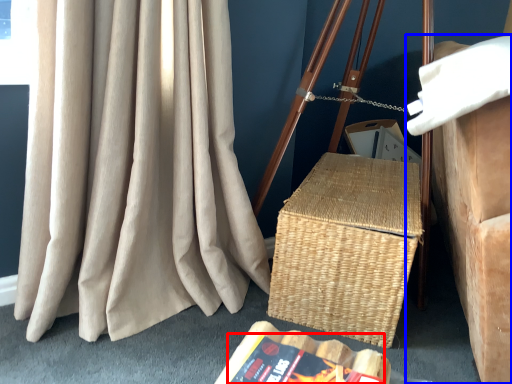
Question: Among these objects, which one is farthest to the camera, paperback book (highlighted by a red box) or furniture (highlighted by a blue box)?

Choices:
 (A) paperback book
 (B) furniture

Answer: (A)